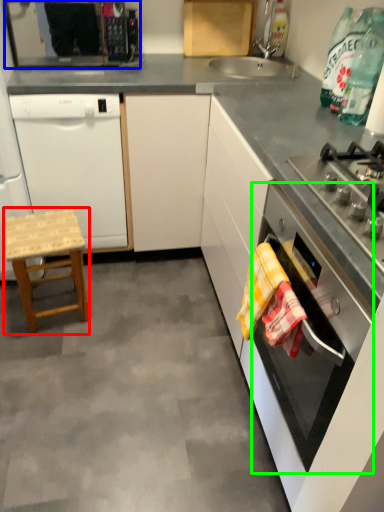
Question: Which object is positioned farthest from stool (highlighted by a red box)? Select from kitchen appliance (highlighted by a blue box) and oven (highlighted by a green box).

Choices:
 (A) kitchen appliance
 (B) oven

Answer: (A)